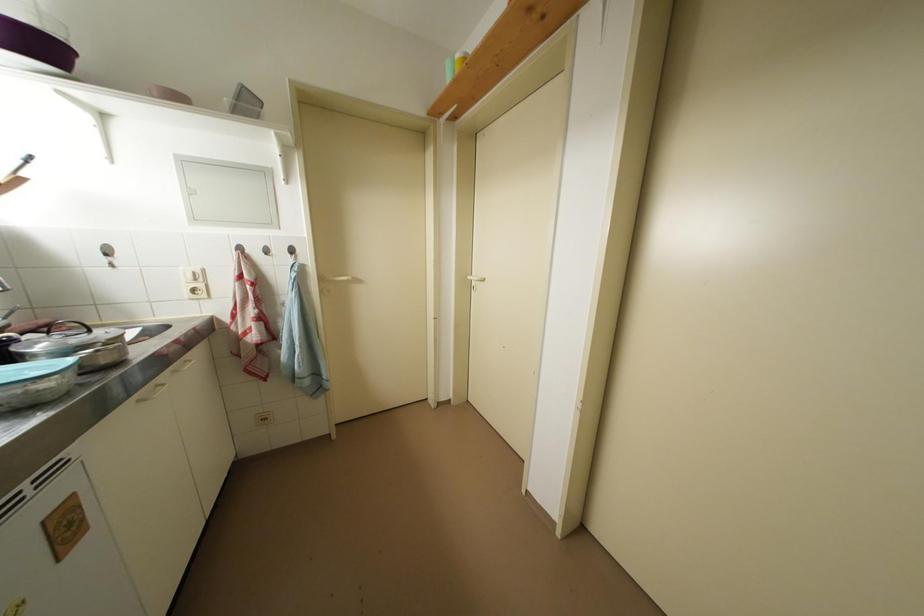
The height and width of the screenshot is (616, 924). Find the location of `faucet handle`. faucet handle is located at coordinates (8, 313).